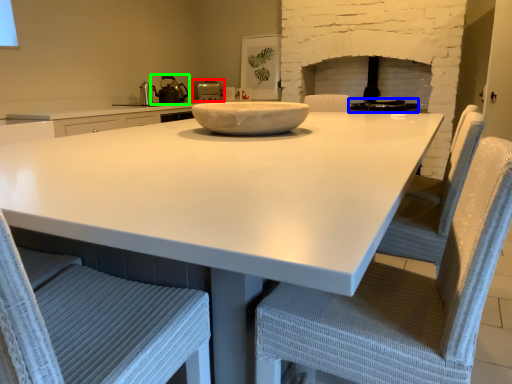
Question: Considering the real-world distances, which object is farthest from kitchen appliance (highlighted by a red box)? appliance (highlighted by a blue box) or tea pot (highlighted by a green box)?

Choices:
 (A) appliance
 (B) tea pot

Answer: (A)